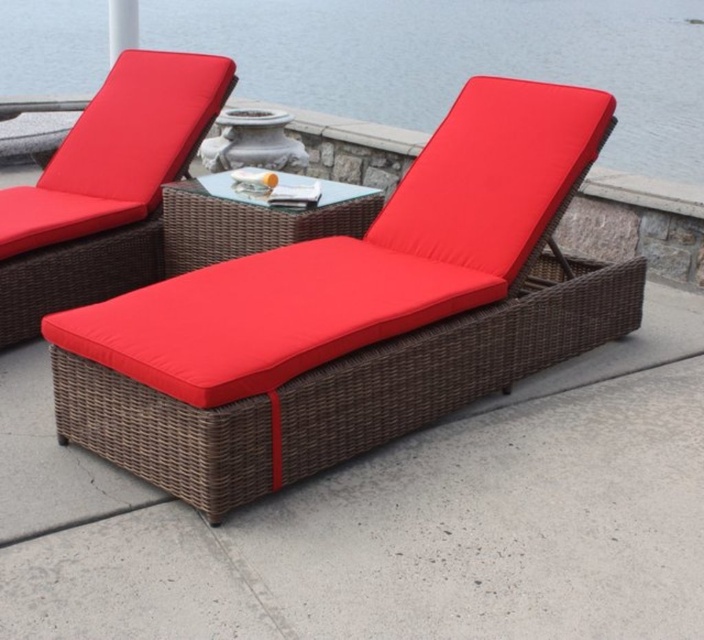
Consider the image. You are planning to place a large rectangular plant stand between the brown wicker chaise lounge at center and the matte wicker chaise at upper left. The plant stand is 1.2 meters wide. Can the space between them accommodate it?

The brown wicker chaise lounge at center is wider than the matte wicker chaise at upper left. However, the exact distance between them isn

You are standing on the patio and see the point marked at coordinates [460,60]. What is located at that point?

The point at [460,60] is on transparent glass water at upper center.

You are a guest at a resort and want to place a drink on the table between the two chaise lounges. However, you notice the transparent glass water at upper center and the matte wicker chaise at upper left. Which object is closer to the table where you want to place your drink?

The transparent glass water at upper center is closer to the table between the two chaise lounges than the matte wicker chaise at upper left, so you should place your drink near the transparent glass water at upper center.